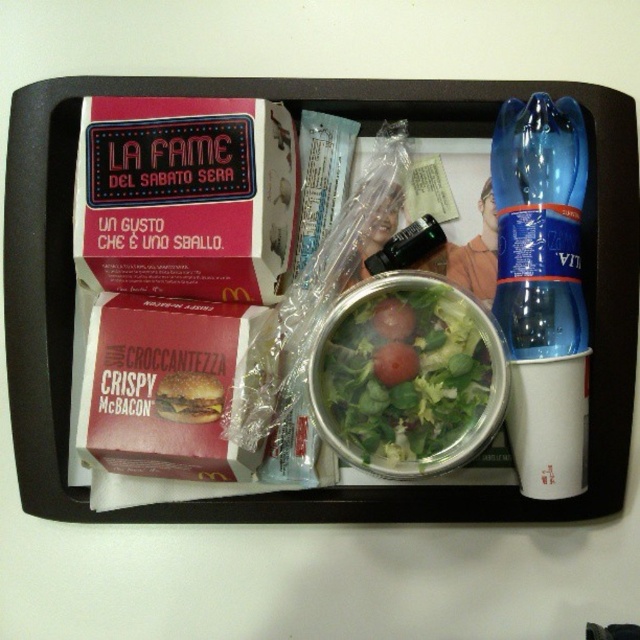
You are taking a photo of the McDonalds tray. You want to focus on the point at the top left corner of the burger box labeled CROCCANTEZZA CRISPY McBACON. The point you want to focus on is at coordinate point (93,157). There is another point at (189,416) which is part of the top box. Which point is closer to the camera?

Point (93,157) is closer to the camera than point (189,416).

You are standing 36.38 inches away from the point at coordinates [554,113] on the McDonalds tray. If you want to grab the burger labeled CROCCANTEZZA CRISPY McBACON, which is located in the lower red box on the left side of the tray, can you reach it without moving your position?

The point at coordinates [554,113] is 36.38 inches away from you. Since the burger labeled CROCCANTEZZA CRISPY McBACON is located in the lower red box on the left side of the tray, which is at that point, you can reach it without moving your position as you are already at the correct distance.